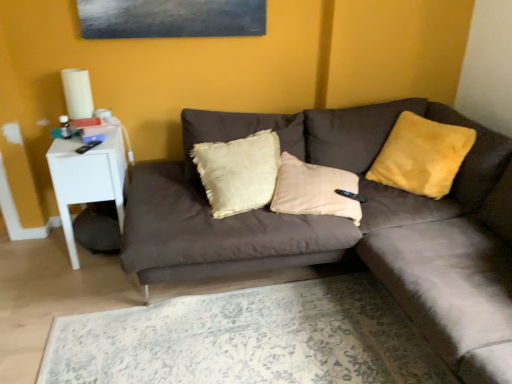
Question: Is white glossy side table at left situated inside velvet brown couch at center or outside?

Choices:
 (A) outside
 (B) inside

Answer: (A)

Question: From the image's perspective, is white glossy side table at left located above or below velvet brown couch at center?

Choices:
 (A) below
 (B) above

Answer: (B)

Question: Considering the real-world distances, which object is closest to the yellow fuzzy pillow at upper right?

Choices:
 (A) velvet brown couch at center
 (B) white glossy side table at left

Answer: (A)

Question: Considering the real-world distances, which object is closest to the velvet brown couch at center?

Choices:
 (A) white glossy side table at left
 (B) yellow fuzzy pillow at upper right

Answer: (B)